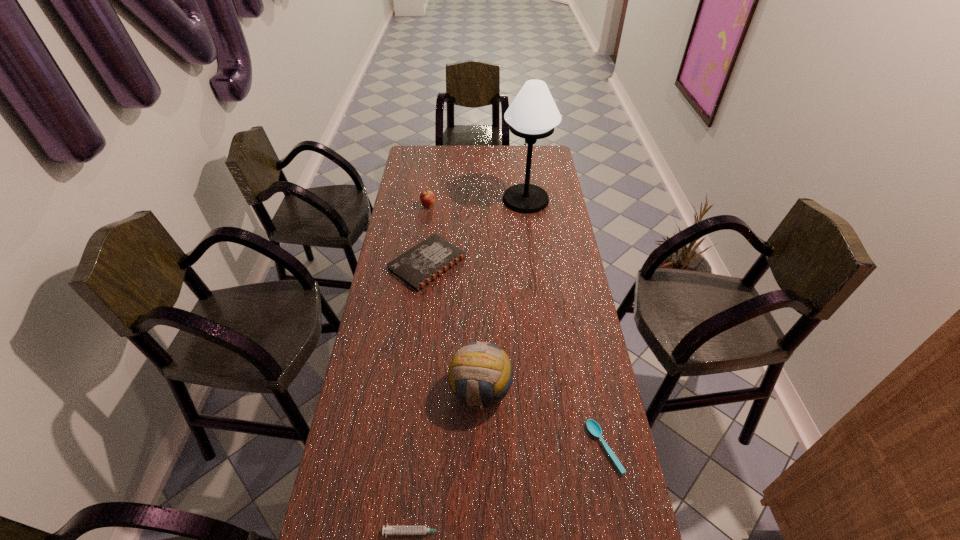
This screenshot has width=960, height=540. What are the coordinates of `vacant space in between the shortest object and the notebook` in the screenshot? It's located at (516, 355).

You are a GUI agent. You are given a task and a screenshot of the screen. Output one action in this format:
    pyautogui.click(x=<x>, y=<y>)
    Task: Click on the vacant space in between the notebook and the syringe
    This screenshot has height=540, width=960.
    Given the screenshot: What is the action you would take?
    pyautogui.click(x=421, y=397)

Locate which object is the closest to the second nearest object. Please provide its 2D coordinates. Your answer should be formatted as a tuple, i.e. [(x, y)], where the tuple contains the x and y coordinates of a point satisfying the conditions above.

[(476, 360)]

The height and width of the screenshot is (540, 960). What are the coordinates of `object that ranks as the fifth closest to the third tallest object` in the screenshot? It's located at (389, 530).